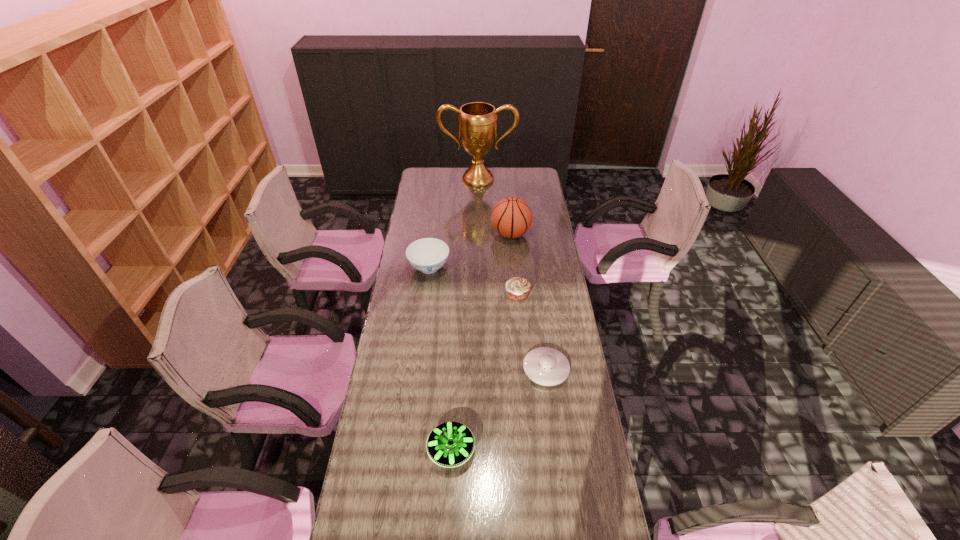
The image size is (960, 540). I want to click on the farthest object, so click(477, 124).

In order to click on trophy cup in this screenshot , I will do `click(477, 124)`.

At what (x,y) coordinates should I click in order to perform the action: click on the fifth nearest object. Please return your answer as a coordinate pair (x, y). The image size is (960, 540). Looking at the image, I should click on (511, 217).

Where is `basketball`? The image size is (960, 540). basketball is located at coordinates (511, 217).

At what (x,y) coordinates should I click in order to perform the action: click on chinaware. Please return your answer as a coordinate pair (x, y). Looking at the image, I should click on (427, 255).

You are a GUI agent. You are given a task and a screenshot of the screen. Output one action in this format:
    pyautogui.click(x=<x>, y=<y>)
    Task: Click on the third nearest object
    This screenshot has width=960, height=540.
    Given the screenshot: What is the action you would take?
    pyautogui.click(x=518, y=289)

I want to click on the taller saucer, so click(450, 444).

Locate an element on the screen. the nearest object is located at coordinates (450, 444).

I want to click on the fifth farthest object, so click(x=546, y=366).

The width and height of the screenshot is (960, 540). What are the coordinates of `the right saucer` in the screenshot? It's located at (546, 366).